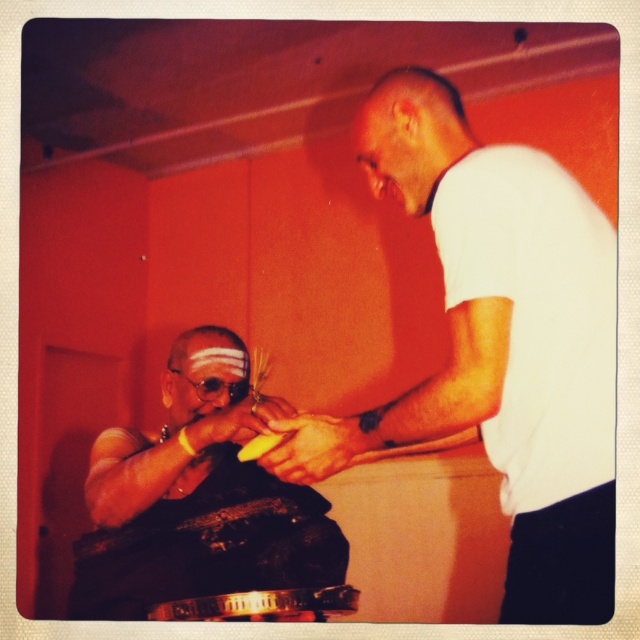
Can you confirm if white matte shirt at center is thinner than matte black cloth at center?

Correct, white matte shirt at center's width is less than matte black cloth at center's.

What do you see at coordinates (499, 342) in the screenshot? I see `white matte shirt at center` at bounding box center [499, 342].

This screenshot has height=640, width=640. Identify the location of white matte shirt at center. (499, 342).

Locate an element on the screen. white matte shirt at center is located at coordinates (499, 342).